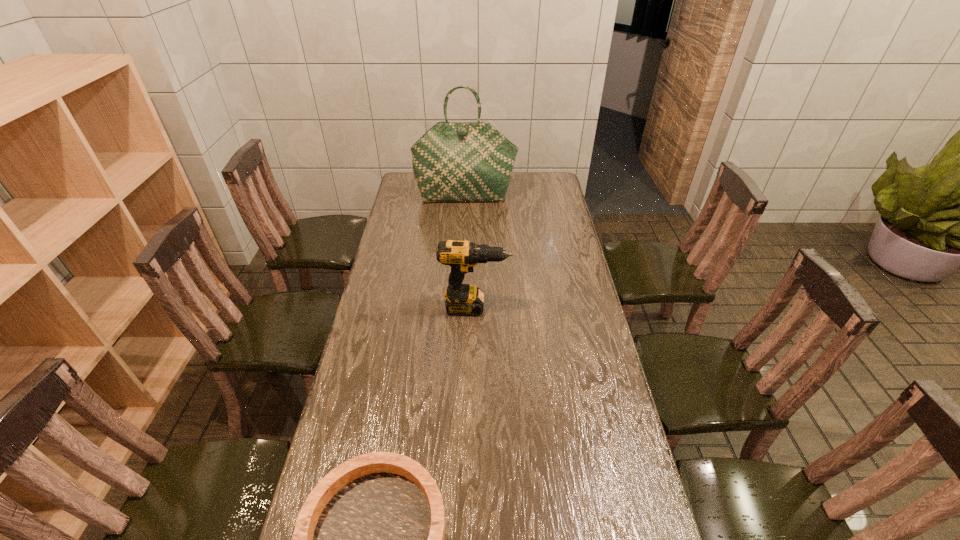
Locate an element on the screen. the tallest object is located at coordinates (453, 161).

Where is `tote bag`? The image size is (960, 540). tote bag is located at coordinates (453, 161).

Where is `the second farthest object`? the second farthest object is located at coordinates (462, 299).

What are the coordinates of `free space located on the right of the tote bag` in the screenshot? It's located at (530, 197).

Locate an element on the screen. The image size is (960, 540). vacant space located 0.290m at the tip of the second nearest object is located at coordinates (589, 308).

You are a GUI agent. You are given a task and a screenshot of the screen. Output one action in this format:
    pyautogui.click(x=<x>, y=<y>)
    Task: Click on the object located at the far edge
    
    Given the screenshot: What is the action you would take?
    [x=453, y=161]

Find the location of `object that is at the left edge`. object that is at the left edge is located at coordinates (x=453, y=161).

Find the location of a particular element. Image resolution: width=960 pixels, height=540 pixels. object at the far left corner is located at coordinates (453, 161).

The width and height of the screenshot is (960, 540). Find the location of `vacant space at the left edge of the desktop`. vacant space at the left edge of the desktop is located at coordinates (384, 246).

I want to click on vacant area at the right edge of the desktop, so click(605, 394).